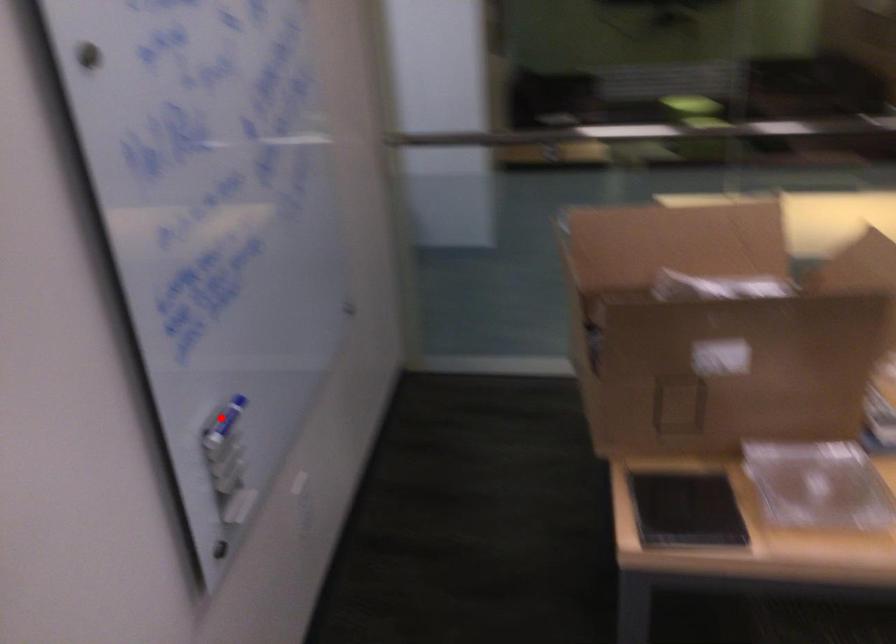
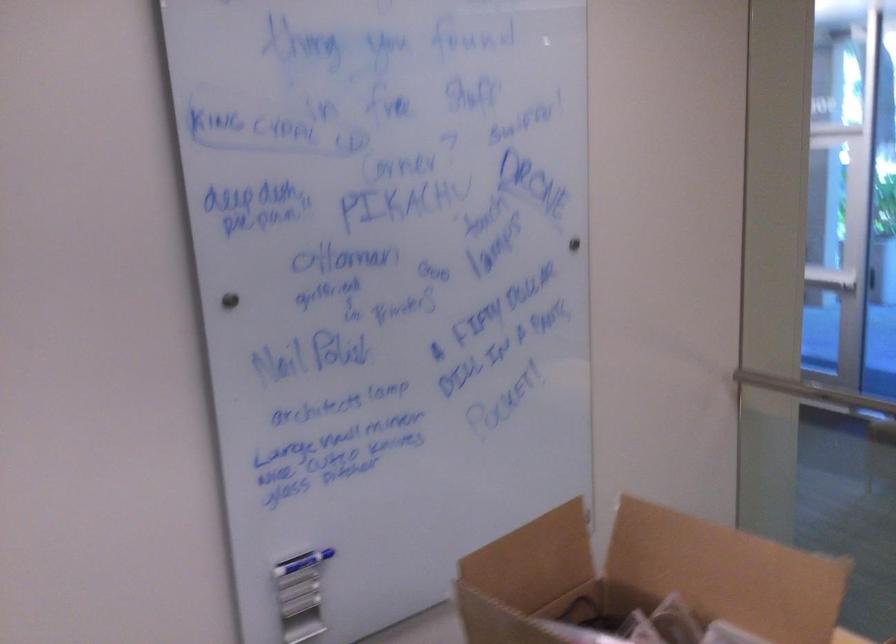
In the second image, find the point that corresponds to the highlighted location in the first image.

(302, 562)